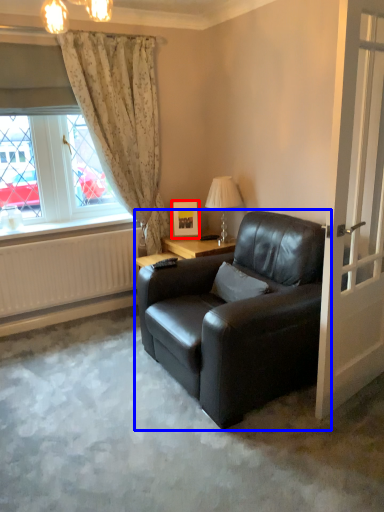
Question: Which point is closer to the camera, picture frame (highlighted by a red box) or chair (highlighted by a blue box)?

Choices:
 (A) picture frame
 (B) chair

Answer: (B)